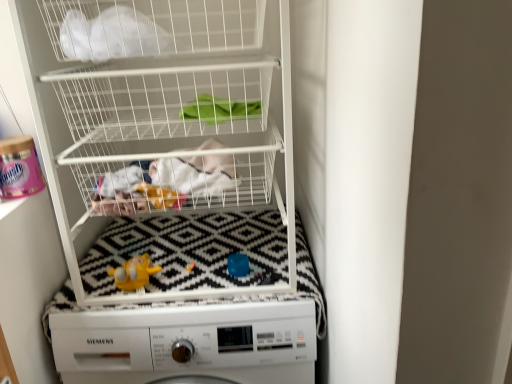
The image size is (512, 384). In order to click on free point below white wire basket at upper center (from a real-world perspective) in this screenshot , I will do `click(206, 241)`.